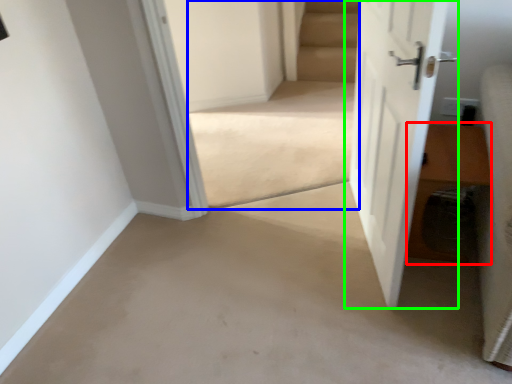
Question: Estimate the real-world distances between objects in this image. Which object is closer to hardwood (highlighted by a red box), stairwell (highlighted by a blue box) or door (highlighted by a green box)?

Choices:
 (A) stairwell
 (B) door

Answer: (B)